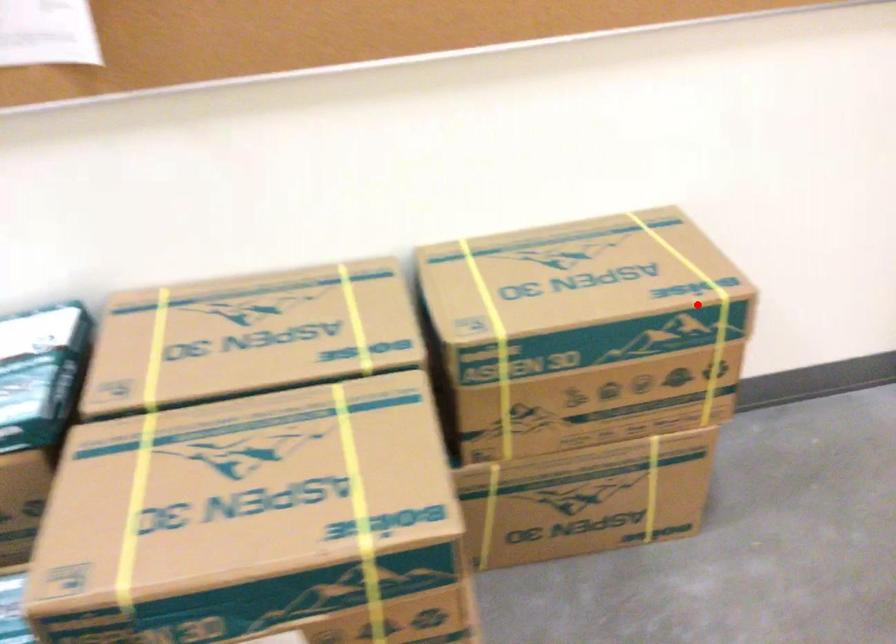
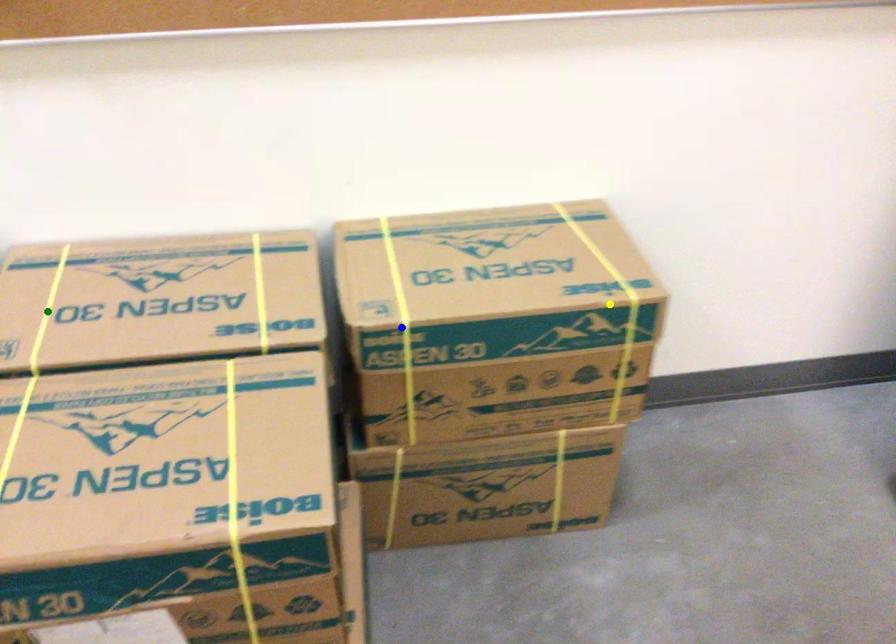
Question: I am providing you with two images of the same scene from different viewpoints. A red point is marked on the first image. You are given multiple points on the second image. Can you choose the point in image 2 that corresponds to the point in image 1?

Choices:
 (A) blue point
 (B) green point
 (C) yellow point

Answer: (C)